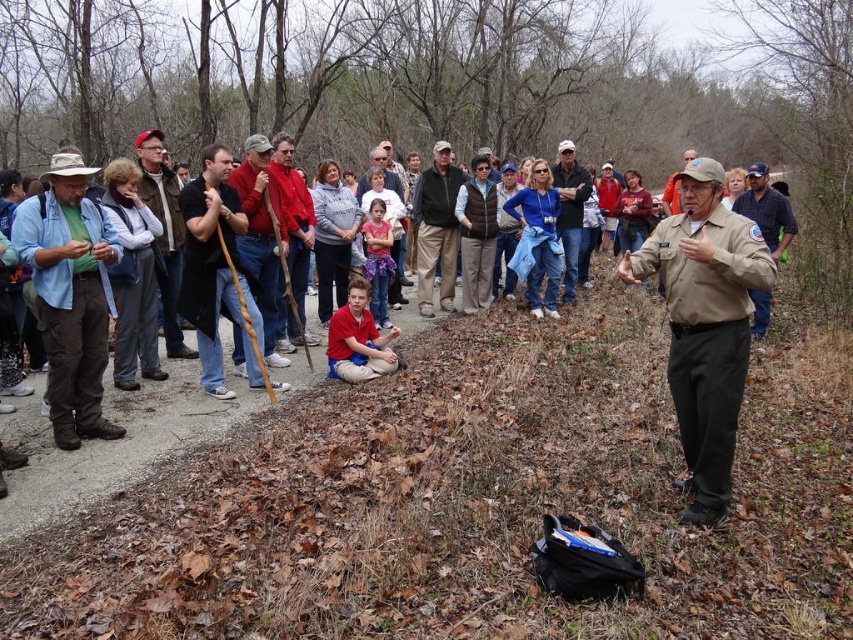
Question: Which is nearer to the brown uniform at center?

Choices:
 (A) matte gray sweater at center
 (B) red cotton shirt at center
 (C) light blue denim shirt at left

Answer: (B)

Question: Is red cotton shirt at center to the left of matte gray sweater at center from the viewer's perspective?

Choices:
 (A) yes
 (B) no

Answer: (A)

Question: Which point is closer to the camera taking this photo?

Choices:
 (A) (299, 180)
 (B) (370, 371)
 (C) (572, 227)

Answer: (B)

Question: Is wooden cane at center further to the viewer compared to red cotton shirt at center?

Choices:
 (A) no
 (B) yes

Answer: (A)

Question: Which point appears closest to the camera in this image?

Choices:
 (A) (563, 196)
 (B) (398, 282)

Answer: (B)

Question: Is brown leather jacket at left bigger than red shirt at center?

Choices:
 (A) no
 (B) yes

Answer: (B)